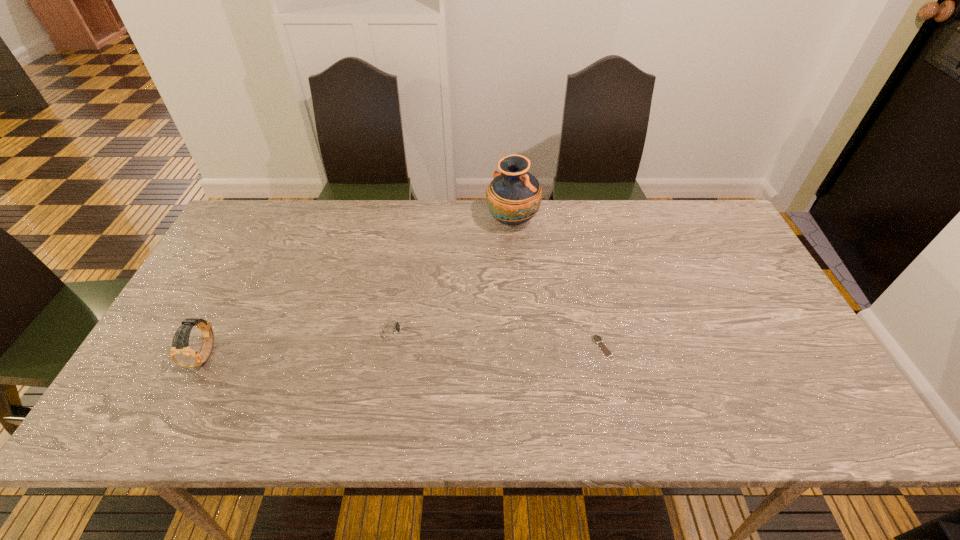
I want to click on vacant region that satisfies the following two spatial constraints: 1. on the face of the second tallest watch; 2. on the face of the leftmost object, so click(x=387, y=354).